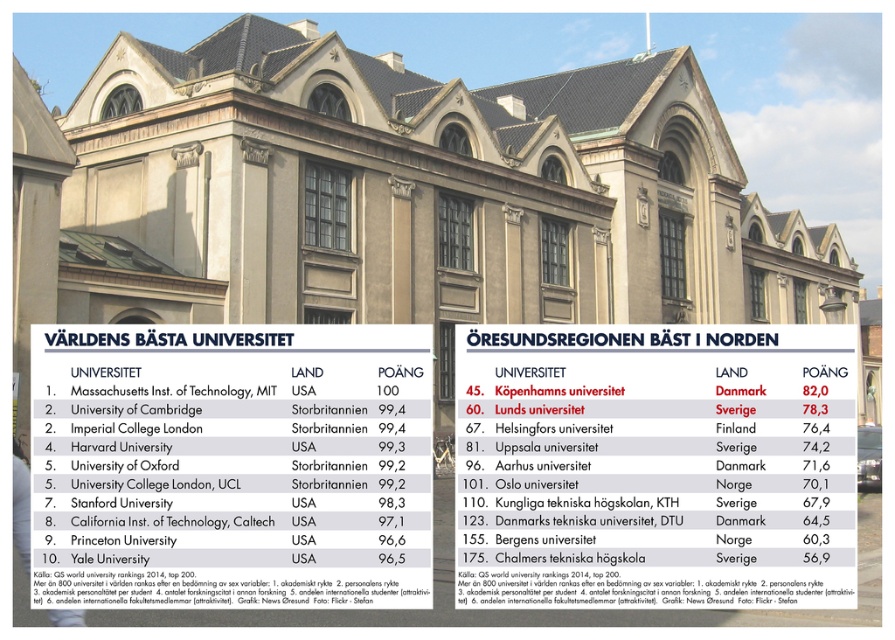
Question: Can you confirm if white paper menu at upper left is smaller than white paper menu at center?

Choices:
 (A) no
 (B) yes

Answer: (B)

Question: Does white paper menu at upper left appear over white paper menu at center?

Choices:
 (A) no
 (B) yes

Answer: (B)

Question: Considering the relative positions of white paper menu at upper left and white paper menu at center in the image provided, where is white paper menu at upper left located with respect to white paper menu at center?

Choices:
 (A) above
 (B) below

Answer: (A)

Question: Which point appears closest to the camera in this image?

Choices:
 (A) (723, 445)
 (B) (125, 493)

Answer: (B)